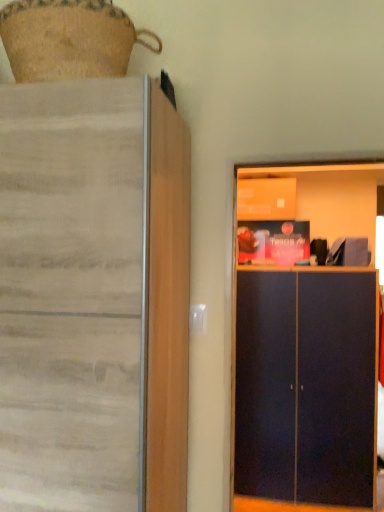
Question: Considering the positions of dark blue matte cabinet at right and matte wood cupboard at left in the image, is dark blue matte cabinet at right wider or thinner than matte wood cupboard at left?

Choices:
 (A) wide
 (B) thin

Answer: (B)

Question: Is dark blue matte cabinet at right spatially inside matte wood cupboard at left, or outside of it?

Choices:
 (A) outside
 (B) inside

Answer: (A)

Question: In terms of height, does dark blue matte cabinet at right look taller or shorter compared to matte wood cupboard at left?

Choices:
 (A) short
 (B) tall

Answer: (A)

Question: From the image's perspective, relative to dark blue matte cabinet at right, is matte wood cupboard at left above or below?

Choices:
 (A) above
 (B) below

Answer: (A)

Question: Looking at the image, does matte wood cupboard at left seem bigger or smaller compared to dark blue matte cabinet at right?

Choices:
 (A) small
 (B) big

Answer: (B)

Question: Considering the positions of matte wood cupboard at left and dark blue matte cabinet at right in the image, is matte wood cupboard at left taller or shorter than dark blue matte cabinet at right?

Choices:
 (A) tall
 (B) short

Answer: (A)

Question: Does point (139, 284) appear closer or farther from the camera than point (372, 396)?

Choices:
 (A) closer
 (B) farther

Answer: (A)